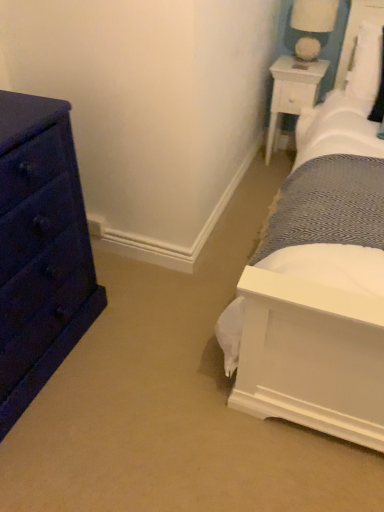
In order to face white fabric-covered lampshade at upper right, should I rotate leftwards or rightwards?

Turn right approximately 15.762 degrees to face it.

In order to face white wood nightstand at upper right, should I rotate leftwards or rightwards?

To align with it, rotate right about 13.207°.

The width and height of the screenshot is (384, 512). I want to click on white fabric-covered lampshade at upper right, so click(x=312, y=26).

Is white wood nightstand at upper right wider or thinner than matte dark blue dresser at left?

white wood nightstand at upper right is thinner than matte dark blue dresser at left.

Is white wood nightstand at upper right further to the viewer compared to matte dark blue dresser at left?

Yes, it is behind matte dark blue dresser at left.

Is point (308, 74) positioned behind point (30, 133)?

Yes.

Locate an element on the screen. Image resolution: width=384 pixels, height=512 pixels. the chest of drawers located above the white wood nightstand at upper right (from a real-world perspective) is located at coordinates (40, 250).

From the image's perspective, between white fabric-covered lampshade at upper right and matte dark blue dresser at left, which one is located above?

From the image's view, white fabric-covered lampshade at upper right is above.

Can you confirm if white fabric-covered lampshade at upper right is thinner than matte dark blue dresser at left?

Yes, white fabric-covered lampshade at upper right is thinner than matte dark blue dresser at left.

Is the depth of white fabric-covered lampshade at upper right less than that of matte dark blue dresser at left?

No, white fabric-covered lampshade at upper right is further to the viewer.

Is white fabric-covered lampshade at upper right situated inside matte dark blue dresser at left or outside?

white fabric-covered lampshade at upper right is not enclosed by matte dark blue dresser at left.

From the image's perspective, which one is positioned higher, matte dark blue dresser at left or white wood nightstand at upper right?

white wood nightstand at upper right, from the image's perspective.

Between matte dark blue dresser at left and white wood nightstand at upper right, which one appears on the left side from the viewer's perspective?

matte dark blue dresser at left is more to the left.

How far apart are matte dark blue dresser at left and white wood nightstand at upper right?

A distance of 1.84 meters exists between matte dark blue dresser at left and white wood nightstand at upper right.

The image size is (384, 512). I want to click on chest of drawers on the left of white wood nightstand at upper right, so click(x=40, y=250).

Is white fabric-covered lampshade at upper right in front of or behind white wood nightstand at upper right in the image?

In the image, white fabric-covered lampshade at upper right appears in front of white wood nightstand at upper right.

In terms of height, does white fabric-covered lampshade at upper right look taller or shorter compared to white wood nightstand at upper right?

Considering their sizes, white fabric-covered lampshade at upper right has less height than white wood nightstand at upper right.

Is point (325, 3) positioned in front of point (316, 75)?

Yes, it is.

Is white fabric-covered lampshade at upper right positioned far away from white wood nightstand at upper right?

No.

Can you confirm if matte dark blue dresser at left is taller than white fabric-covered lampshade at upper right?

Yes.

In terms of width, does matte dark blue dresser at left look wider or thinner when compared to white fabric-covered lampshade at upper right?

matte dark blue dresser at left is wider than white fabric-covered lampshade at upper right.

From the image's perspective, which one is positioned higher, matte dark blue dresser at left or white fabric-covered lampshade at upper right?

From the image's view, white fabric-covered lampshade at upper right is above.

Measure the distance from matte dark blue dresser at left to white fabric-covered lampshade at upper right.

The distance of matte dark blue dresser at left from white fabric-covered lampshade at upper right is 1.96 meters.

Where is `table lamp located above the white wood nightstand at upper right (from a real-world perspective)`? This screenshot has width=384, height=512. table lamp located above the white wood nightstand at upper right (from a real-world perspective) is located at coordinates (312, 26).

In the image, is white wood nightstand at upper right positioned in front of or behind white fabric-covered lampshade at upper right?

Visually, white wood nightstand at upper right is located behind white fabric-covered lampshade at upper right.

Based on the photo, can you confirm if white wood nightstand at upper right is thinner than white fabric-covered lampshade at upper right?

In fact, white wood nightstand at upper right might be wider than white fabric-covered lampshade at upper right.

From the image's perspective, is white wood nightstand at upper right located beneath white fabric-covered lampshade at upper right?

Indeed, from the image's perspective, white wood nightstand at upper right is shown beneath white fabric-covered lampshade at upper right.

This screenshot has width=384, height=512. What are the coordinates of `nightstand beneath the matte dark blue dresser at left (from a real-world perspective)` in the screenshot? It's located at (292, 92).

The height and width of the screenshot is (512, 384). I want to click on table lamp behind the matte dark blue dresser at left, so click(x=312, y=26).

Considering their positions, is white wood nightstand at upper right positioned further to white fabric-covered lampshade at upper right than matte dark blue dresser at left?

matte dark blue dresser at left is further to white fabric-covered lampshade at upper right.

Considering their positions, is white fabric-covered lampshade at upper right positioned further to white wood nightstand at upper right than matte dark blue dresser at left?

matte dark blue dresser at left is further to white wood nightstand at upper right.

Which object lies nearer to the anchor point white wood nightstand at upper right, matte dark blue dresser at left or white fabric-covered lampshade at upper right?

Based on the image, white fabric-covered lampshade at upper right appears to be nearer to white wood nightstand at upper right.

Considering their positions, is white wood nightstand at upper right positioned further to matte dark blue dresser at left than white fabric-covered lampshade at upper right?

white fabric-covered lampshade at upper right is positioned further to the anchor matte dark blue dresser at left.

Considering their positions, is white fabric-covered lampshade at upper right positioned closer to matte dark blue dresser at left than white wood nightstand at upper right?

white wood nightstand at upper right is positioned closer to the anchor matte dark blue dresser at left.

Looking at the image, which one is located further to white fabric-covered lampshade at upper right, matte dark blue dresser at left or white wood nightstand at upper right?

matte dark blue dresser at left lies further to white fabric-covered lampshade at upper right than the other object.

You are a GUI agent. You are given a task and a screenshot of the screen. Output one action in this format:
    pyautogui.click(x=<x>, y=<y>)
    Task: Click on the table lamp located between matte dark blue dresser at left and white wood nightstand at upper right in the depth direction
    This screenshot has height=512, width=384.
    Given the screenshot: What is the action you would take?
    pyautogui.click(x=312, y=26)